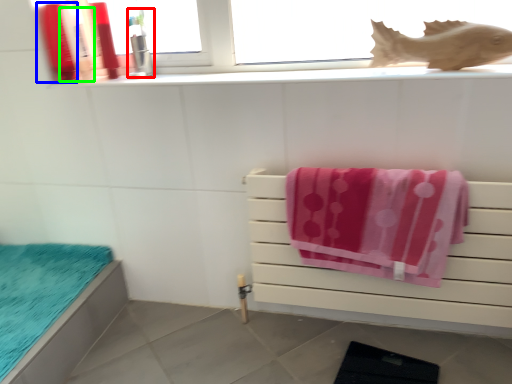
Question: Which object is the closest to the toiletry (highlighted by a red box)? Choose among these: toiletry (highlighted by a blue box) or toiletry (highlighted by a green box).

Choices:
 (A) toiletry
 (B) toiletry

Answer: (B)